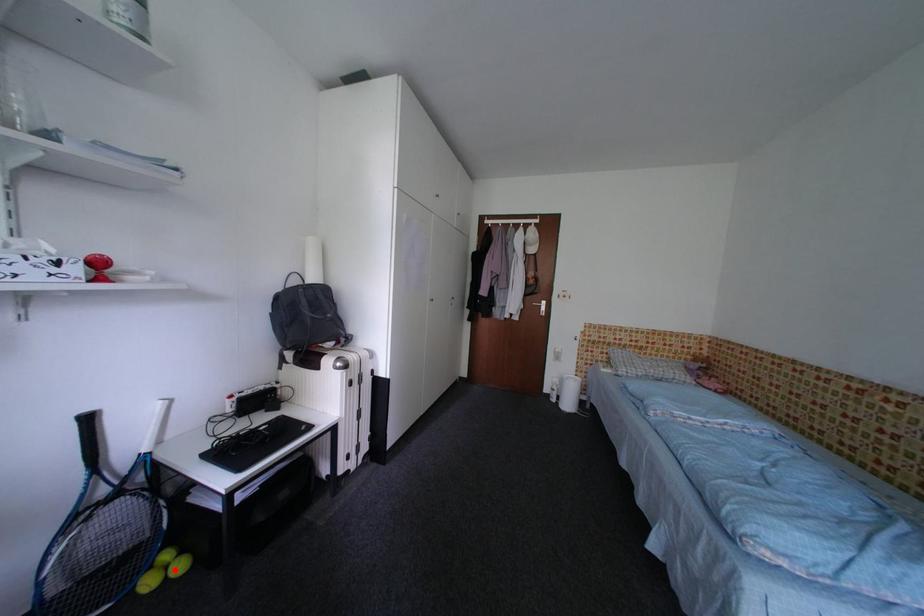
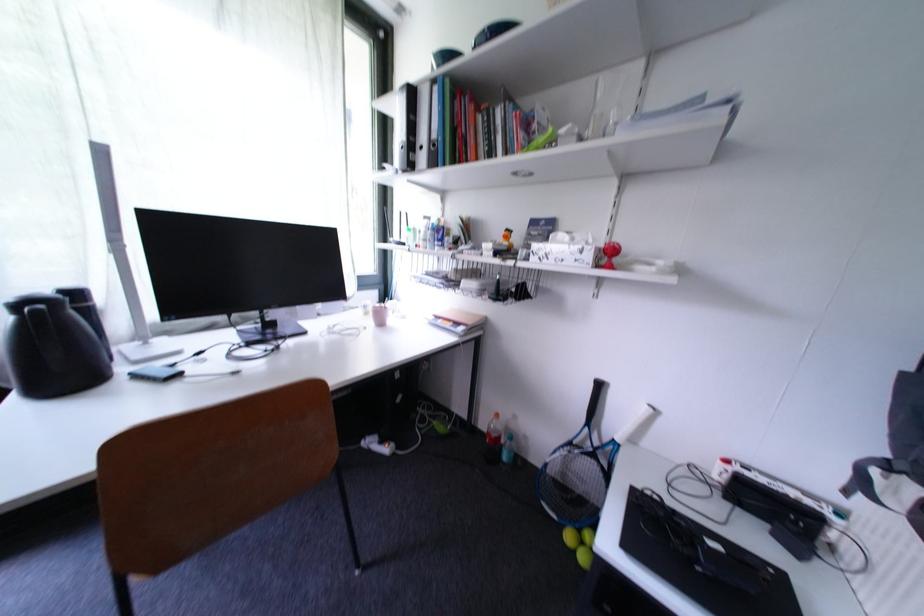
Locate, in the second image, the point that corresponds to the highlighted location in the first image.

(590, 546)